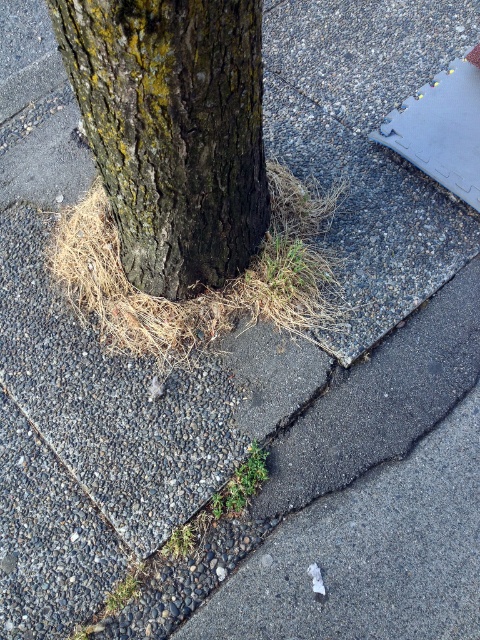
Based on the photo, does brown dry grass at center come behind green grassy weed at lower center?

Yes.

Who is more distant from viewer, (276, 257) or (238, 476)?

Point (276, 257)

Which is behind, point (120, 308) or point (261, 465)?

Point (120, 308)

The height and width of the screenshot is (640, 480). Identify the location of brown dry grass at center. (204, 289).

Who is shorter, dark brown rough bark at center or green grassy weed at lower center?

green grassy weed at lower center

Who is lower down, dark brown rough bark at center or green grassy weed at lower center?

green grassy weed at lower center

Is point (168, 92) positioned in front of point (212, 500)?

Yes, point (168, 92) is in front of point (212, 500).

Find the location of a particular element. The width and height of the screenshot is (480, 640). dark brown rough bark at center is located at coordinates (172, 131).

Is dark brown rough bark at center to the right of brown dry grass at center from the viewer's perspective?

Correct, you'll find dark brown rough bark at center to the right of brown dry grass at center.

Is point (136, 129) farther from camera compared to point (334, 314)?

No, it is in front of (334, 314).

The image size is (480, 640). In order to click on dark brown rough bark at center in this screenshot , I will do click(172, 131).

You are a GUI agent. You are given a task and a screenshot of the screen. Output one action in this format:
    pyautogui.click(x=<x>, y=<y>)
    Task: Click on the dark brown rough bark at center
    
    Given the screenshot: What is the action you would take?
    pos(172,131)